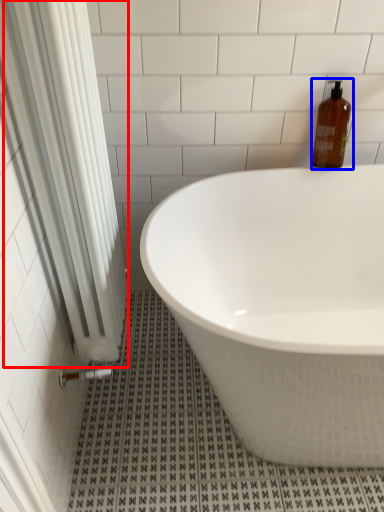
Question: Which of the following is the farthest to the observer, shower curtain (highlighted by a red box) or bottle (highlighted by a blue box)?

Choices:
 (A) shower curtain
 (B) bottle

Answer: (B)